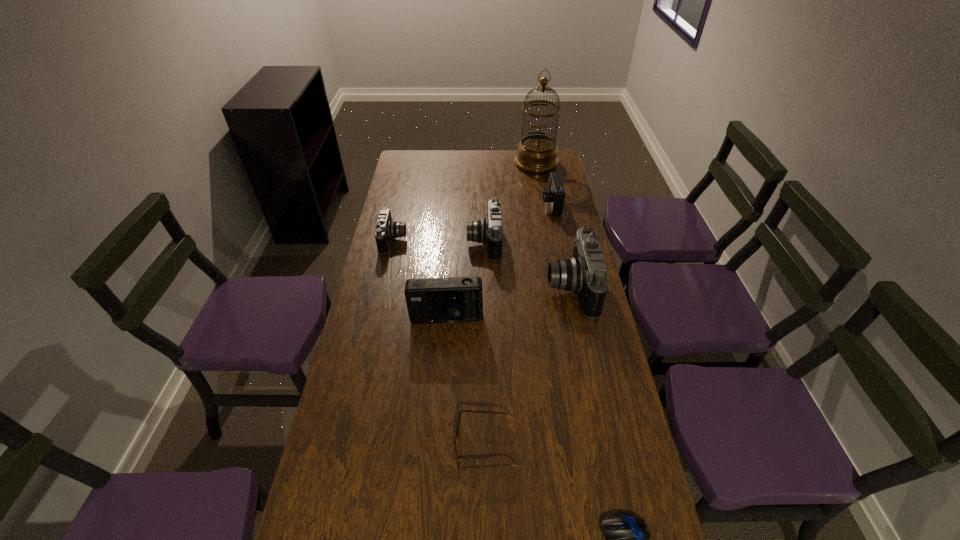
The image size is (960, 540). I want to click on golden birdcage, so click(x=537, y=153).

I want to click on the farthest object, so click(537, 153).

Locate an element on the screen. The width and height of the screenshot is (960, 540). the rightmost black camera is located at coordinates (585, 273).

This screenshot has width=960, height=540. I want to click on the tallest camera, so click(585, 273).

Image resolution: width=960 pixels, height=540 pixels. In order to click on the bigger blue camera in this screenshot , I will do `click(452, 300)`.

Identify the location of the nearer blue camera. (452, 300).

Identify the location of the second black camera from right to left. (484, 231).

The image size is (960, 540). In order to click on the farther blue camera in this screenshot , I will do `click(555, 194)`.

Locate an element on the screen. This screenshot has width=960, height=540. the right blue camera is located at coordinates (555, 194).

Find the location of a particular element. the leftmost black camera is located at coordinates (386, 229).